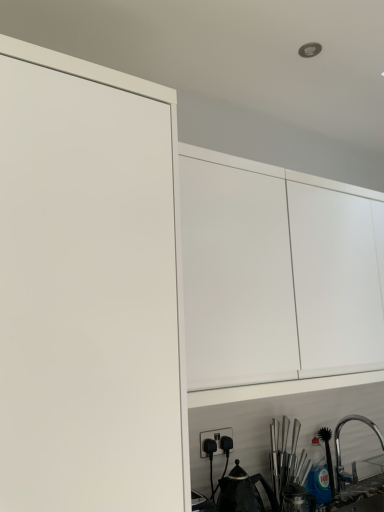
Question: Could you tell me if satin nickel faucet at lower right is facing black plastic electric outlet at lower center?

Choices:
 (A) no
 (B) yes

Answer: (A)

Question: Considering the relative sizes of satin nickel faucet at lower right and black plastic electric outlet at lower center in the image provided, is satin nickel faucet at lower right wider than black plastic electric outlet at lower center?

Choices:
 (A) no
 (B) yes

Answer: (B)

Question: Is satin nickel faucet at lower right to the right of black plastic electric outlet at lower center from the viewer's perspective?

Choices:
 (A) yes
 (B) no

Answer: (A)

Question: From a real-world perspective, does satin nickel faucet at lower right sit lower than black plastic electric outlet at lower center?

Choices:
 (A) yes
 (B) no

Answer: (A)

Question: From the image's perspective, is satin nickel faucet at lower right on top of black plastic electric outlet at lower center?

Choices:
 (A) yes
 (B) no

Answer: (B)

Question: In the image, is satin nickel faucet at lower right positioned in front of or behind black matte tea pot at lower center?

Choices:
 (A) behind
 (B) front

Answer: (A)

Question: Considering the positions of point (337, 459) and point (226, 497), is point (337, 459) closer or farther from the camera than point (226, 497)?

Choices:
 (A) farther
 (B) closer

Answer: (A)

Question: In terms of width, does satin nickel faucet at lower right look wider or thinner when compared to black matte tea pot at lower center?

Choices:
 (A) thin
 (B) wide

Answer: (B)

Question: Is satin nickel faucet at lower right situated inside black matte tea pot at lower center or outside?

Choices:
 (A) outside
 (B) inside

Answer: (A)

Question: Considering the positions of point (223, 479) and point (200, 456), is point (223, 479) closer or farther from the camera than point (200, 456)?

Choices:
 (A) closer
 (B) farther

Answer: (B)

Question: Relative to black plastic electric outlet at lower center, is black matte tea pot at lower center in front or behind?

Choices:
 (A) front
 (B) behind

Answer: (A)

Question: Considering the positions of black matte tea pot at lower center and black plastic electric outlet at lower center in the image, is black matte tea pot at lower center wider or thinner than black plastic electric outlet at lower center?

Choices:
 (A) thin
 (B) wide

Answer: (B)

Question: From the image's perspective, is black matte tea pot at lower center positioned above or below black plastic electric outlet at lower center?

Choices:
 (A) below
 (B) above

Answer: (A)

Question: From a real-world perspective, is white matte cabinet at upper center positioned above or below satin nickel faucet at lower right?

Choices:
 (A) below
 (B) above

Answer: (B)

Question: Is white matte cabinet at upper center in front of or behind satin nickel faucet at lower right in the image?

Choices:
 (A) front
 (B) behind

Answer: (A)